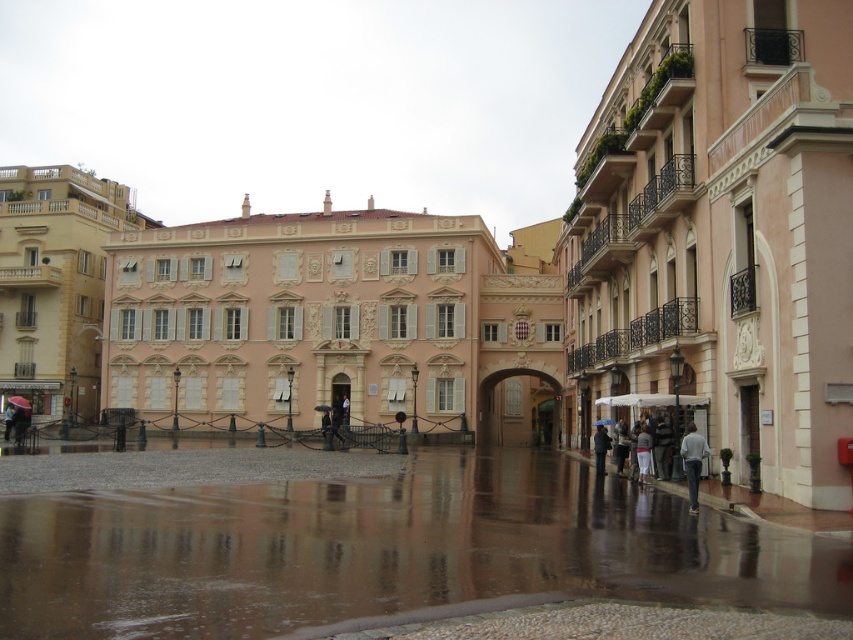
You are standing in the plaza and want to take a photo of both the matte pink building at center and the matte beige building at left. Which building should you focus on first if you want to capture them both in the same frame without moving your camera?

The matte pink building at center is above the matte beige building at left, so you should focus on the matte beige building at left first to ensure both are in the frame.

You are a photographer standing in the plaza and want to capture both the matte black umbrella at lower left and the transparent plastic umbrella at center in a single shot. Which umbrella is closer to you?

The matte black umbrella at lower left is closer to you since it is positioned below the transparent plastic umbrella at center, indicating it is in front.